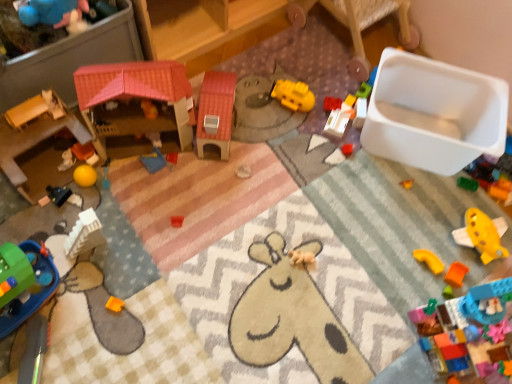
Where is `vacant area that lies between yellow plastic airplane at lower right, arranged as the 15th toy when viewed from the left, and green plastic toy at lower left, acting as the second toy starting from the left`? The height and width of the screenshot is (384, 512). vacant area that lies between yellow plastic airplane at lower right, arranged as the 15th toy when viewed from the left, and green plastic toy at lower left, acting as the second toy starting from the left is located at coordinates (255, 269).